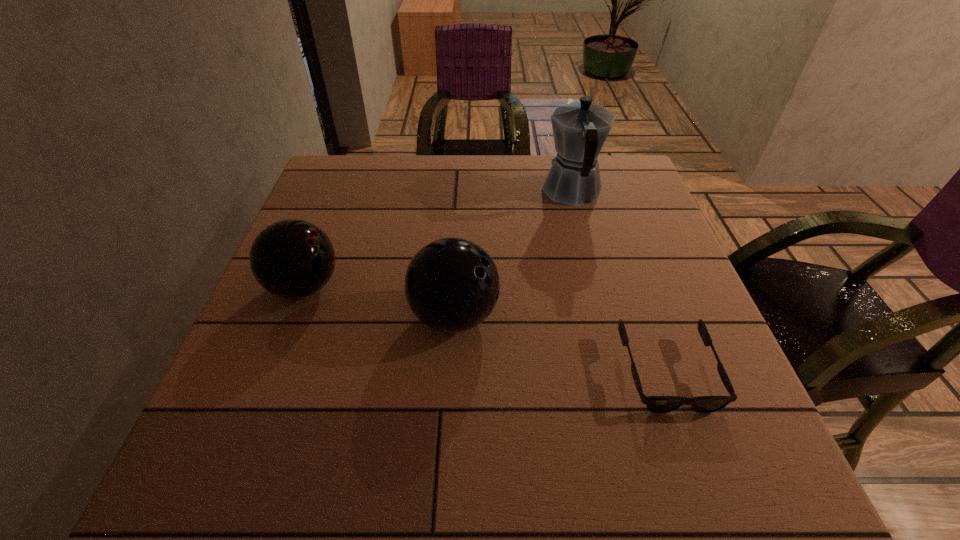
Where is `empty space between the sunglasses and the right bowling ball`? Image resolution: width=960 pixels, height=540 pixels. empty space between the sunglasses and the right bowling ball is located at coordinates (561, 344).

This screenshot has height=540, width=960. Find the location of `object that is the closest to the sunglasses`. object that is the closest to the sunglasses is located at coordinates (452, 285).

At what (x,y) coordinates should I click in order to perform the action: click on object that is the nearest to the leftmost object. Please return your answer as a coordinate pair (x, y). This screenshot has height=540, width=960. Looking at the image, I should click on (452, 285).